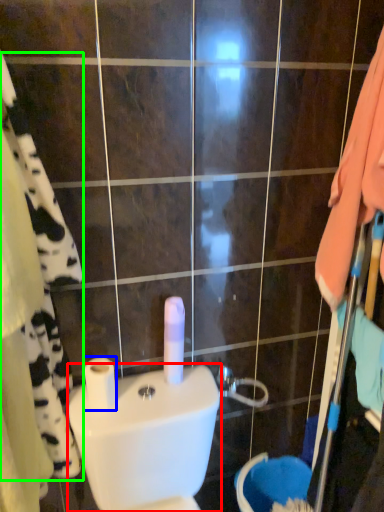
Question: Which object is positioned farthest from toilet bowl (highlighted by a red box)? Select from toilet paper (highlighted by a blue box) and bath towel (highlighted by a green box).

Choices:
 (A) toilet paper
 (B) bath towel

Answer: (B)